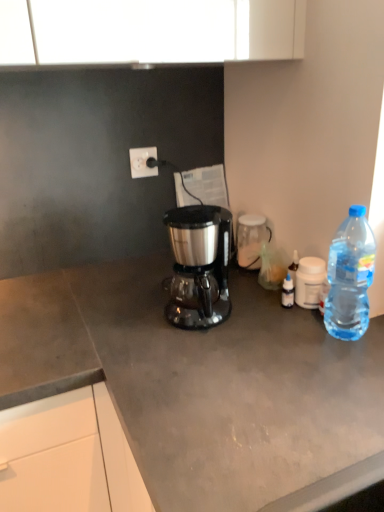
Question: Considering the relative sizes of satin black coffee maker at center and clear plastic bottle at right in the image provided, is satin black coffee maker at center wider than clear plastic bottle at right?

Choices:
 (A) yes
 (B) no

Answer: (A)

Question: Is satin black coffee maker at center positioned far away from clear plastic bottle at right?

Choices:
 (A) yes
 (B) no

Answer: (B)

Question: Is satin black coffee maker at center next to clear plastic bottle at right and touching it?

Choices:
 (A) yes
 (B) no

Answer: (B)

Question: Is satin black coffee maker at center facing towards clear plastic bottle at right?

Choices:
 (A) no
 (B) yes

Answer: (A)

Question: From the image's perspective, is satin black coffee maker at center above clear plastic bottle at right?

Choices:
 (A) no
 (B) yes

Answer: (A)

Question: Is transparent glass jar at center, arranged as the second coffee cup when viewed from the front, taller or shorter than clear plastic bottle at right?

Choices:
 (A) tall
 (B) short

Answer: (B)

Question: Looking at the image, does transparent glass jar at center, positioned as the 1th coffee cup in left-to-right order, seem bigger or smaller compared to clear plastic bottle at right?

Choices:
 (A) small
 (B) big

Answer: (A)

Question: Based on their positions, is transparent glass jar at center, which is the second coffee cup from right to left, located to the left or right of clear plastic bottle at right?

Choices:
 (A) left
 (B) right

Answer: (A)

Question: Which is correct: transparent glass jar at center, which is the second coffee cup from right to left, is inside clear plastic bottle at right, or outside of it?

Choices:
 (A) outside
 (B) inside

Answer: (A)

Question: In terms of width, does white plastic power outlet at upper center look wider or thinner when compared to clear plastic bottle at right?

Choices:
 (A) wide
 (B) thin

Answer: (B)

Question: From a real-world perspective, relative to clear plastic bottle at right, is white plastic power outlet at upper center vertically above or below?

Choices:
 (A) above
 (B) below

Answer: (A)

Question: Is point (145, 174) closer or farther from the camera than point (331, 324)?

Choices:
 (A) closer
 (B) farther

Answer: (B)

Question: Considering their positions, is white plastic power outlet at upper center located in front of or behind clear plastic bottle at right?

Choices:
 (A) front
 (B) behind

Answer: (B)

Question: In terms of height, does clear plastic bottle at right look taller or shorter compared to transparent glass jar at center, positioned as the 1th coffee cup in left-to-right order?

Choices:
 (A) tall
 (B) short

Answer: (A)

Question: Is clear plastic bottle at right in front of or behind transparent glass jar at center, arranged as the 1th coffee cup when viewed from the back, in the image?

Choices:
 (A) front
 (B) behind

Answer: (A)